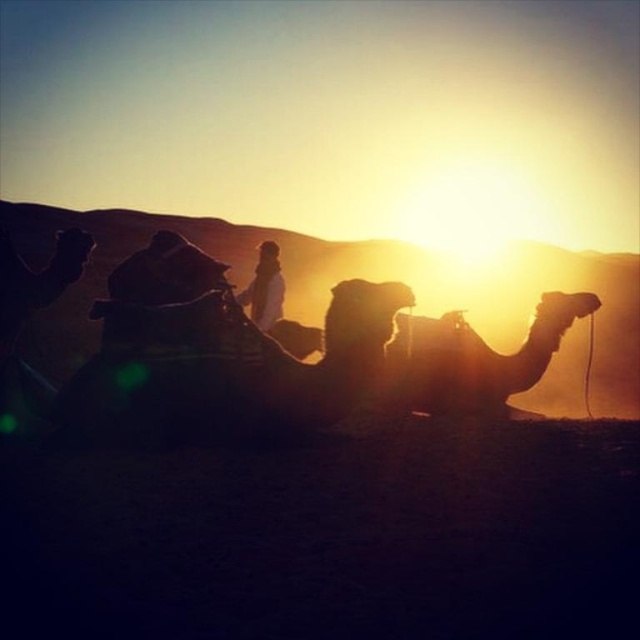
Question: Can you confirm if brown textured camel at center is positioned to the left of white textured clothing at center?

Choices:
 (A) yes
 (B) no

Answer: (B)

Question: Can you confirm if brown textured camel at center is wider than white textured clothing at center?

Choices:
 (A) yes
 (B) no

Answer: (A)

Question: In this image, where is brown textured camel at center located relative to white textured clothing at center?

Choices:
 (A) right
 (B) left

Answer: (A)

Question: Which object is closer to the camera taking this photo?

Choices:
 (A) white textured clothing at center
 (B) brown textured camel at center

Answer: (B)